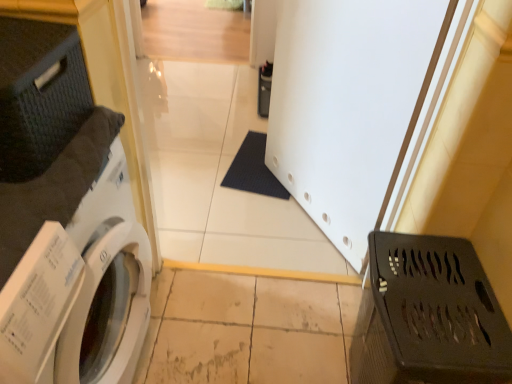
Question: Can you confirm if white glossy washing machine at left is wider than black plastic laundry basket at lower right?

Choices:
 (A) yes
 (B) no

Answer: (A)

Question: Would you say black plastic laundry basket at lower right is part of white glossy washing machine at left's contents?

Choices:
 (A) no
 (B) yes

Answer: (A)

Question: From the image's perspective, is white glossy washing machine at left located beneath black plastic laundry basket at lower right?

Choices:
 (A) yes
 (B) no

Answer: (B)

Question: Is white glossy washing machine at left to the right of black plastic laundry basket at lower right from the viewer's perspective?

Choices:
 (A) no
 (B) yes

Answer: (A)

Question: Is white glossy washing machine at left facing away from black plastic laundry basket at lower right?

Choices:
 (A) no
 (B) yes

Answer: (A)

Question: Considering the positions of white matte screen door at center and white glossy washing machine at left in the image, is white matte screen door at center bigger or smaller than white glossy washing machine at left?

Choices:
 (A) small
 (B) big

Answer: (A)

Question: Looking at their shapes, would you say white matte screen door at center is wider or thinner than white glossy washing machine at left?

Choices:
 (A) thin
 (B) wide

Answer: (A)

Question: Considering the positions of white matte screen door at center and white glossy washing machine at left in the image, is white matte screen door at center taller or shorter than white glossy washing machine at left?

Choices:
 (A) tall
 (B) short

Answer: (A)

Question: Based on their positions, is white matte screen door at center located to the left or right of white glossy washing machine at left?

Choices:
 (A) left
 (B) right

Answer: (B)

Question: In the image, is white glossy washing machine at left on the left side or the right side of black plastic laundry basket at lower right?

Choices:
 (A) right
 (B) left

Answer: (B)

Question: Would you say white glossy washing machine at left is inside or outside black plastic laundry basket at lower right?

Choices:
 (A) outside
 (B) inside

Answer: (A)

Question: Is point (15, 327) positioned closer to the camera than point (394, 243)?

Choices:
 (A) closer
 (B) farther

Answer: (A)

Question: In the image, is white glossy washing machine at left positioned in front of or behind black plastic laundry basket at lower right?

Choices:
 (A) behind
 (B) front

Answer: (B)

Question: Based on their positions, is white matte screen door at center located to the left or right of black plastic laundry basket at lower right?

Choices:
 (A) right
 (B) left

Answer: (B)

Question: Considering the positions of white matte screen door at center and black plastic laundry basket at lower right in the image, is white matte screen door at center wider or thinner than black plastic laundry basket at lower right?

Choices:
 (A) thin
 (B) wide

Answer: (A)